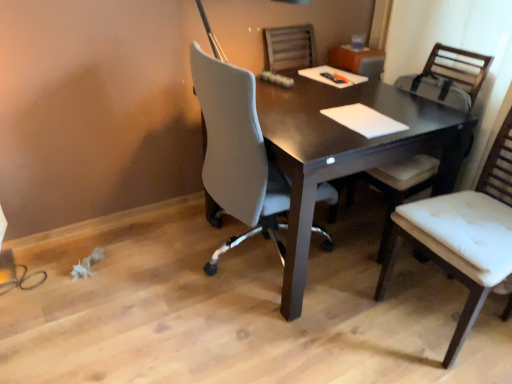
At what (x,y) coordinates should I click in order to perform the action: click on free space above dark wood desk at center (from a real-world perspective). Please return your answer as a coordinate pair (x, y). Looking at the image, I should click on (313, 96).